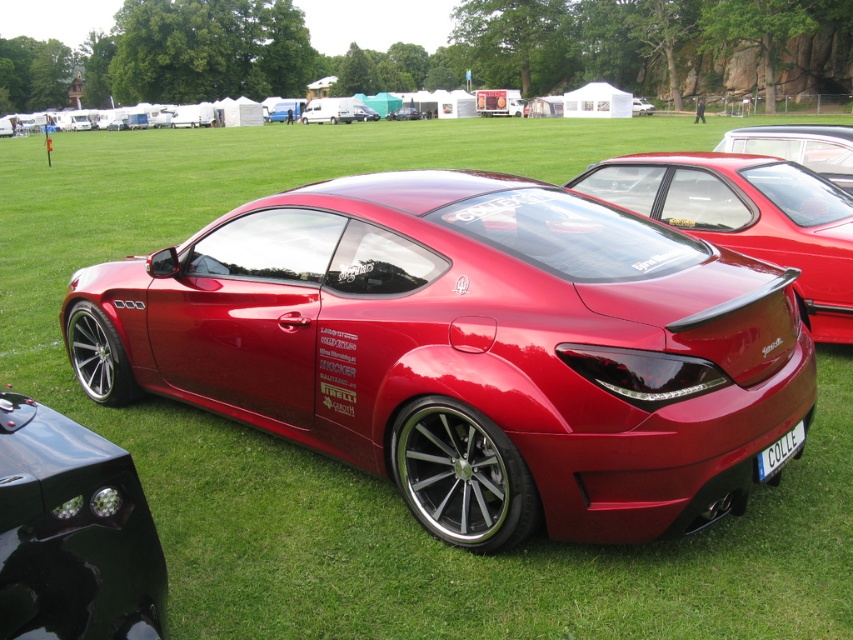
Is shiny red car at center below glossy metallic car at center?

Indeed, shiny red car at center is positioned under glossy metallic car at center.

Can you confirm if shiny red car at center is thinner than glossy metallic car at center?

Indeed, shiny red car at center has a lesser width compared to glossy metallic car at center.

Is point (677, 204) farther from viewer compared to point (373, 120)?

No, (677, 204) is in front of (373, 120).

You are a GUI agent. You are given a task and a screenshot of the screen. Output one action in this format:
    pyautogui.click(x=<x>, y=<y>)
    Task: Click on the shiny red car at center
    This screenshot has width=853, height=640.
    Given the screenshot: What is the action you would take?
    pyautogui.click(x=746, y=218)

Which of these two, glossy black car at center or glossy red car at center, stands taller?

With more height is glossy red car at center.

Which is behind, point (93, 637) or point (779, 150)?

The point (779, 150) is behind.

Find the location of a particular element. Image resolution: width=853 pixels, height=640 pixels. glossy black car at center is located at coordinates (73, 532).

Does point (757, 477) come closer to viewer compared to point (352, 116)?

Yes, point (757, 477) is closer to viewer.

Does white plastic license plate at rear appear over glossy metallic van at center?

Incorrect, white plastic license plate at rear is not positioned above glossy metallic van at center.

Where is `white plastic license plate at rear`? white plastic license plate at rear is located at coordinates (779, 452).